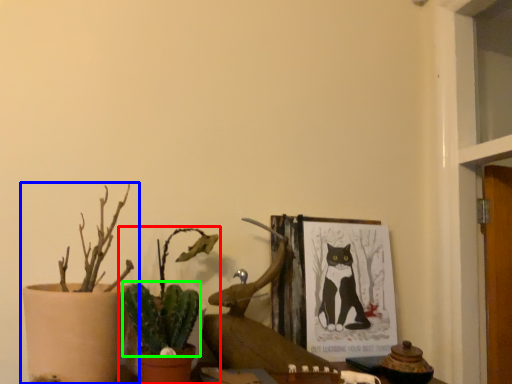
Question: Which is farther away from houseplant (highlighted by a red box)? houseplant (highlighted by a blue box) or plant (highlighted by a green box)?

Choices:
 (A) houseplant
 (B) plant

Answer: (A)